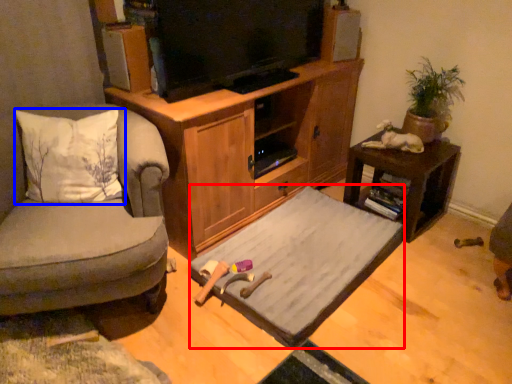
Question: Which point is closer to the camera, bed frame (highlighted by a red box) or pillow (highlighted by a blue box)?

Choices:
 (A) bed frame
 (B) pillow

Answer: (B)